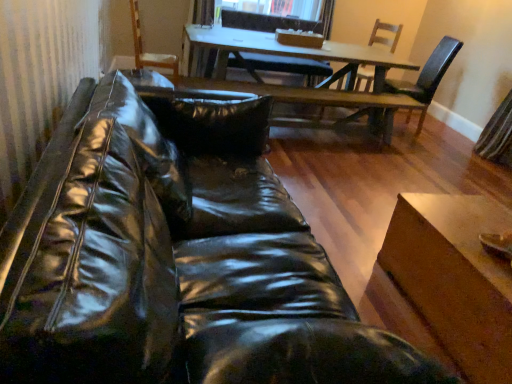
Question: Can you confirm if wooden armchair at upper center is smaller than glossy leather couch at lower left?

Choices:
 (A) yes
 (B) no

Answer: (A)

Question: Is glossy leather couch at lower left completely or partially inside wooden armchair at upper center?

Choices:
 (A) yes
 (B) no

Answer: (B)

Question: Is wooden armchair at upper center positioned beyond the bounds of glossy leather couch at lower left?

Choices:
 (A) no
 (B) yes

Answer: (B)

Question: Can you confirm if wooden armchair at upper center is shorter than glossy leather couch at lower left?

Choices:
 (A) no
 (B) yes

Answer: (B)

Question: Does wooden armchair at upper center have a greater width compared to glossy leather couch at lower left?

Choices:
 (A) yes
 (B) no

Answer: (B)

Question: Is matte black chair at upper right, the 3th chair from the left, taller or shorter than wooden chair at upper right, arranged as the second chair when viewed from the right?

Choices:
 (A) short
 (B) tall

Answer: (B)

Question: Looking at the image, does matte black chair at upper right, the 3th chair from the left, seem bigger or smaller compared to wooden chair at upper right, the 2th chair when ordered from left to right?

Choices:
 (A) big
 (B) small

Answer: (A)

Question: Is matte black chair at upper right, the 3th chair from the left, wider or thinner than wooden chair at upper right, the 2th chair when ordered from left to right?

Choices:
 (A) wide
 (B) thin

Answer: (A)

Question: Is matte black chair at upper right, the 3th chair from the left, in front of or behind wooden chair at upper right, the 2th chair when ordered from left to right, in the image?

Choices:
 (A) behind
 (B) front

Answer: (B)

Question: Considering the positions of wooden chair at upper center, the 1th chair when ordered from left to right, and wooden chair at upper right, the 2th chair when ordered from left to right, in the image, is wooden chair at upper center, the 1th chair when ordered from left to right, bigger or smaller than wooden chair at upper right, the 2th chair when ordered from left to right,?

Choices:
 (A) big
 (B) small

Answer: (A)

Question: From their relative heights in the image, would you say wooden chair at upper center, placed as the third chair when sorted from right to left, is taller or shorter than wooden chair at upper right, the 2th chair when ordered from left to right?

Choices:
 (A) short
 (B) tall

Answer: (B)

Question: From a real-world perspective, is wooden chair at upper center, placed as the third chair when sorted from right to left, physically located above or below wooden chair at upper right, arranged as the second chair when viewed from the right?

Choices:
 (A) below
 (B) above

Answer: (A)

Question: Choose the correct answer: Is wooden chair at upper center, the 1th chair when ordered from left to right, inside wooden chair at upper right, arranged as the second chair when viewed from the right, or outside it?

Choices:
 (A) outside
 (B) inside

Answer: (A)

Question: Is glossy leather couch at lower left to the left or to the right of wooden chair at upper center, placed as the third chair when sorted from right to left, in the image?

Choices:
 (A) left
 (B) right

Answer: (A)

Question: Is glossy leather couch at lower left taller or shorter than wooden chair at upper center, placed as the third chair when sorted from right to left?

Choices:
 (A) short
 (B) tall

Answer: (A)